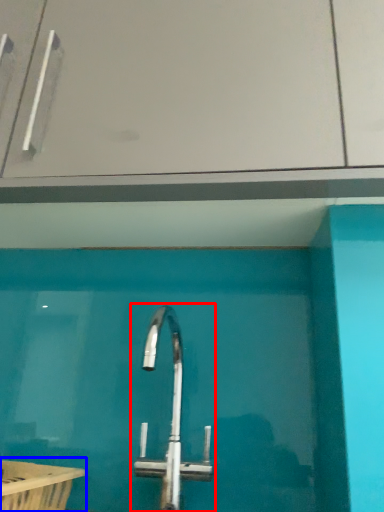
Question: Which point is further to the camera, tap (highlighted by a red box) or bath (highlighted by a blue box)?

Choices:
 (A) tap
 (B) bath

Answer: (A)